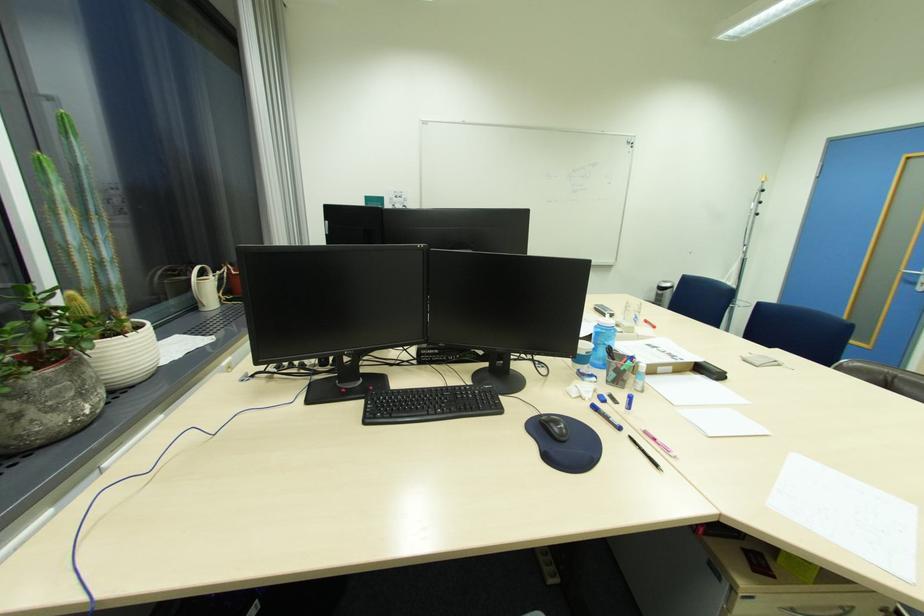
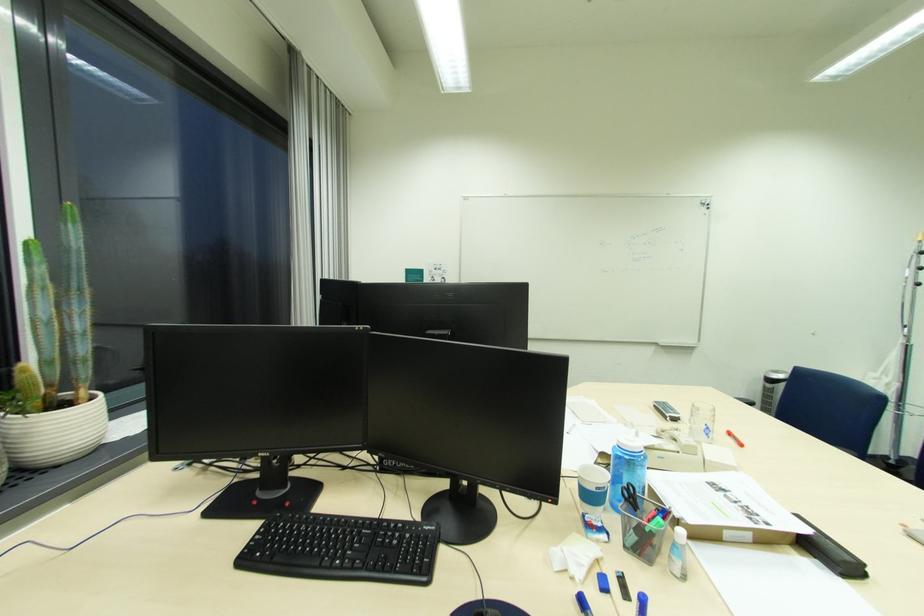
In the second image, find the point that corresponds to (x=473, y=398) in the first image.

(396, 541)